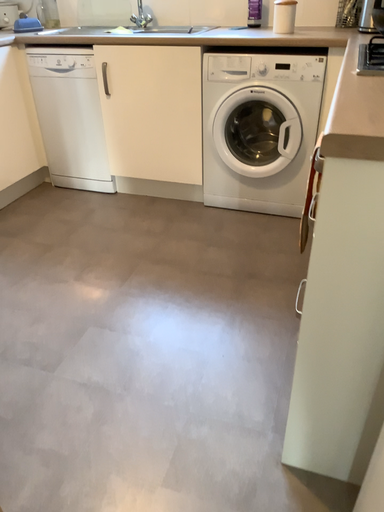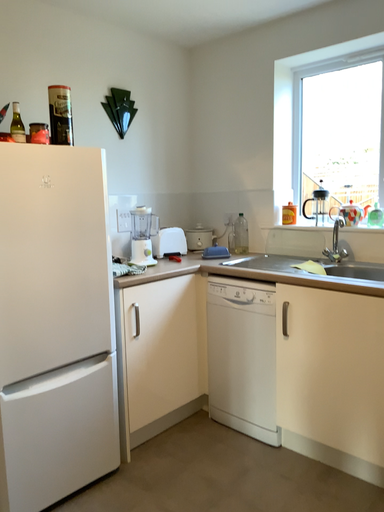
Question: How did the camera likely rotate when shooting the video?

Choices:
 (A) rotated left
 (B) rotated right

Answer: (A)